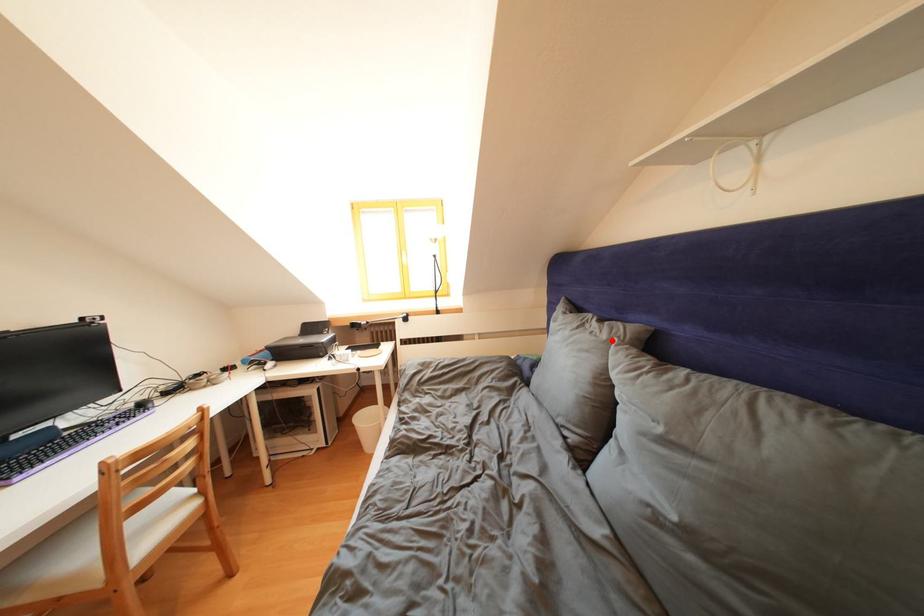
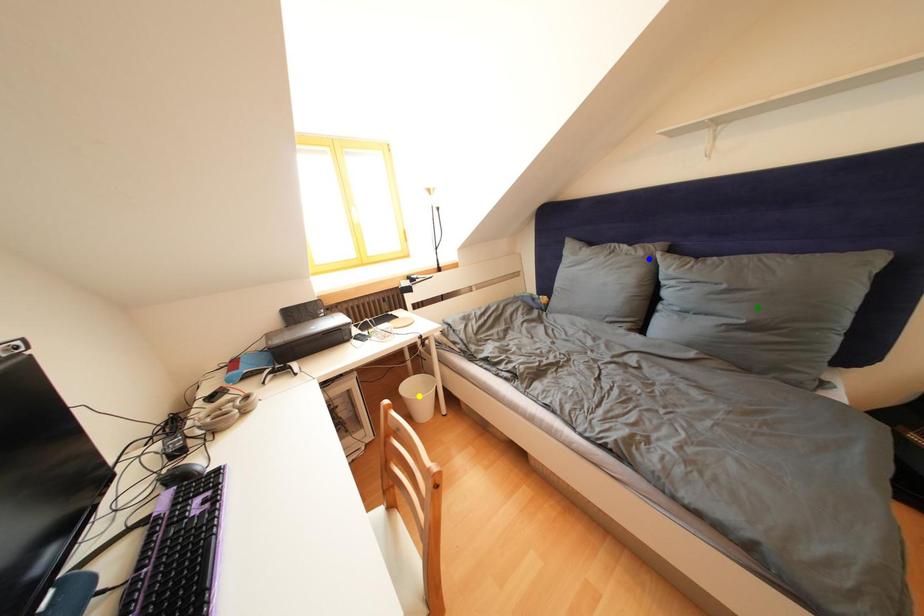
Question: I am providing you with two images of the same scene from different viewpoints. A red point is marked on the first image. You are given multiple points on the second image. Can you choose the point in image 2 that corresponds to the point in image 1?

Choices:
 (A) blue point
 (B) yellow point
 (C) green point

Answer: (A)